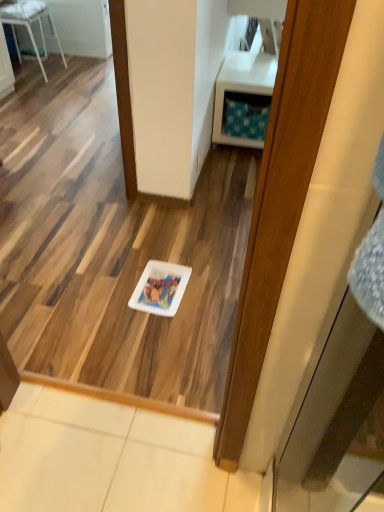
Find the location of a particular element. The height and width of the screenshot is (512, 384). vacant region below white glossy plate at center (from a real-world perspective) is located at coordinates (163, 287).